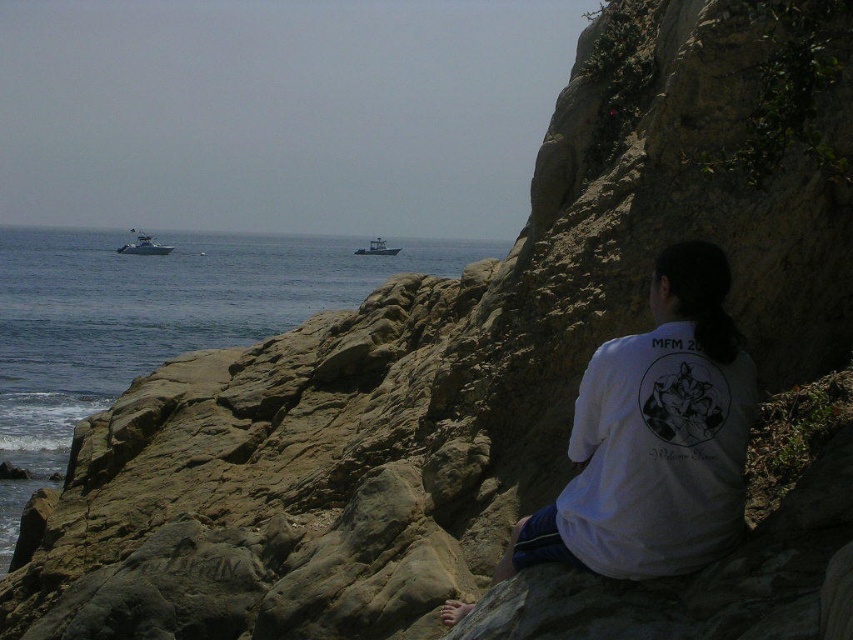
Can you confirm if white plastic boat at left is positioned to the right of white plastic boat at center?

No, white plastic boat at left is not to the right of white plastic boat at center.

Does white plastic boat at left appear over white plastic boat at center?

Yes.

At what (x,y) coordinates should I click in order to perform the action: click on white plastic boat at left. Please return your answer as a coordinate pair (x, y). This screenshot has width=853, height=640. Looking at the image, I should click on (143, 244).

This screenshot has width=853, height=640. Find the location of `white plastic boat at left`. white plastic boat at left is located at coordinates (143, 244).

Who is taller, blue water at center or white plastic boat at left?

blue water at center

Find the location of `blue water at center`. blue water at center is located at coordinates (154, 320).

Image resolution: width=853 pixels, height=640 pixels. In order to click on blue water at center in this screenshot , I will do `click(154, 320)`.

Can you confirm if blue water at center is smaller than white plastic boat at center?

No, blue water at center is not smaller than white plastic boat at center.

Between blue water at center and white plastic boat at center, which one appears on the right side from the viewer's perspective?

white plastic boat at center is more to the right.

Measure the distance between point (85, 257) and camera.

309.49 meters

Identify the location of blue water at center. This screenshot has width=853, height=640. (154, 320).